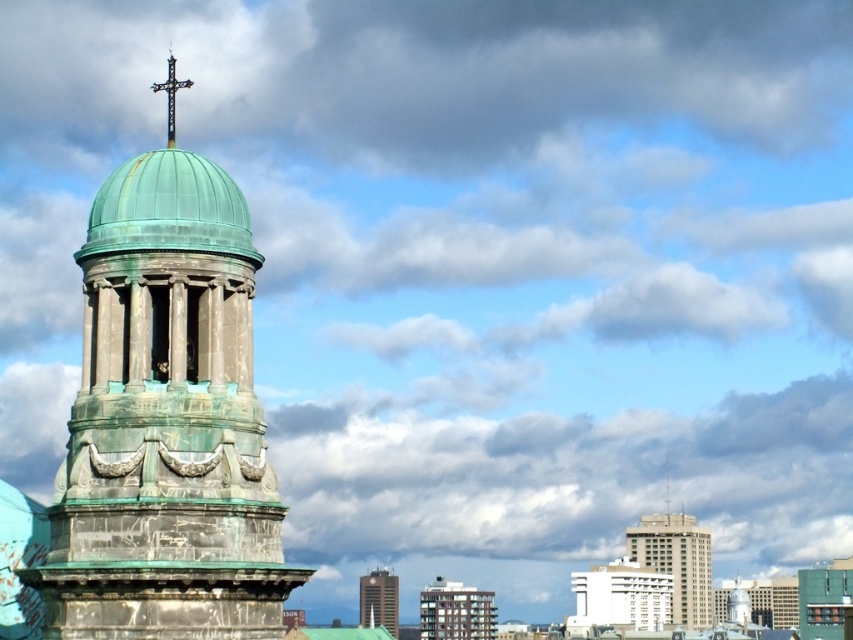
Question: Does smooth concrete building at lower center have a larger size compared to black metal cross at upper center?

Choices:
 (A) yes
 (B) no

Answer: (B)

Question: Can you confirm if white marble hotel at center is positioned to the right of smooth concrete building at lower center?

Choices:
 (A) yes
 (B) no

Answer: (A)

Question: Can you confirm if smooth concrete building at lower center is positioned below green marble tower at center?

Choices:
 (A) yes
 (B) no

Answer: (A)

Question: Which point appears closest to the camera in this image?

Choices:
 (A) (173, 72)
 (B) (49, 572)
 (C) (619, 557)

Answer: (B)

Question: Among these points, which one is farthest from the camera?

Choices:
 (A) (172, 131)
 (B) (640, 540)
 (C) (363, 600)
 (D) (86, 433)

Answer: (C)

Question: Based on their relative distances, which object is farther from the white marble hotel at center?

Choices:
 (A) gray concrete building at center
 (B) green patina stone tower at left
 (C) smooth concrete building at lower center

Answer: (B)